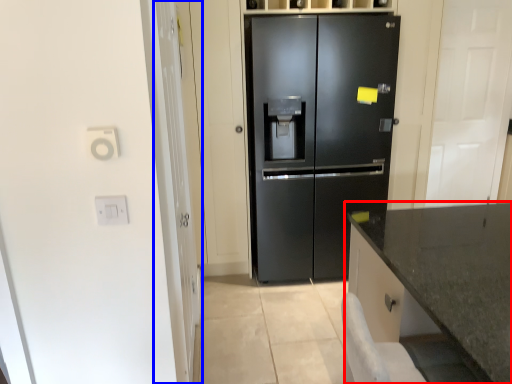
Question: Which object is further to the camera taking this photo, countertop (highlighted by a red box) or glass door (highlighted by a blue box)?

Choices:
 (A) countertop
 (B) glass door

Answer: (B)